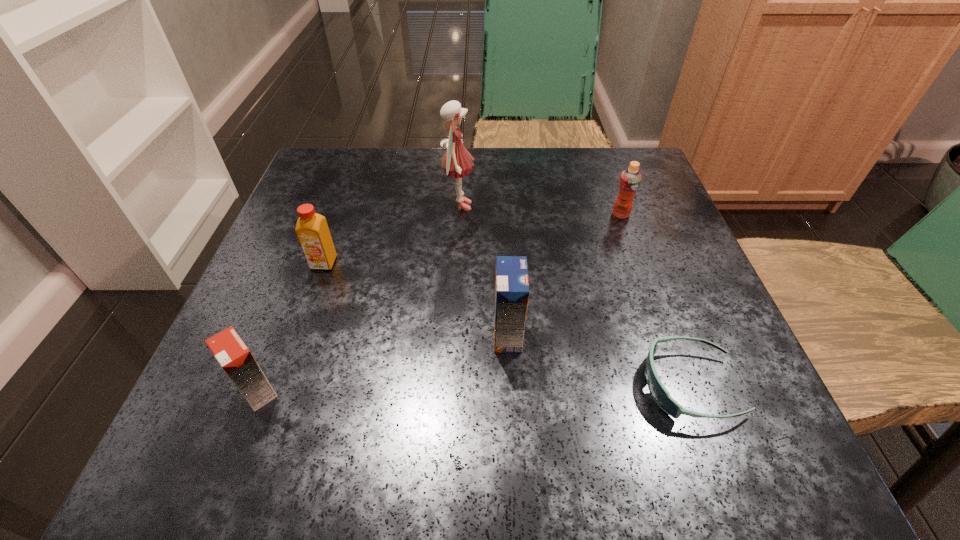
Locate an element on the screen. This screenshot has height=540, width=960. the tallest object is located at coordinates (456, 162).

Identify the location of the fourth object from right to left. This screenshot has height=540, width=960. (456, 162).

Where is `the third farthest orange juice`? The image size is (960, 540). the third farthest orange juice is located at coordinates (511, 280).

Where is `the third orange juice from left to right`? This screenshot has width=960, height=540. the third orange juice from left to right is located at coordinates (511, 280).

I want to click on the fourth nearest object, so click(312, 230).

Where is `the farthest orange juice`? The height and width of the screenshot is (540, 960). the farthest orange juice is located at coordinates (630, 179).

The height and width of the screenshot is (540, 960). I want to click on the nearest orange juice, so click(230, 351).

Identify the location of the shortest object. The image size is (960, 540). (659, 393).

This screenshot has width=960, height=540. Identify the location of free space located on the front-facing side of the third object from left to right. (563, 206).

Where is `free point located on the back of the fourth object from left to right`? The width and height of the screenshot is (960, 540). free point located on the back of the fourth object from left to right is located at coordinates (500, 192).